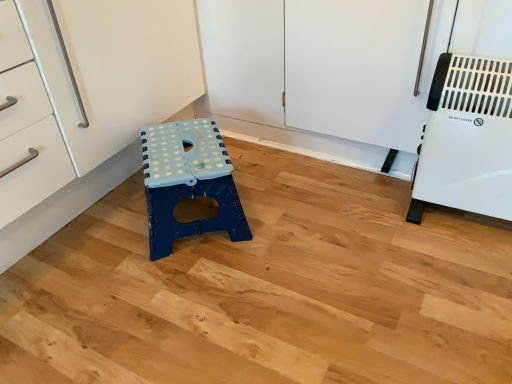
Identify the location of vacant area in front of white plastic heater at right. (464, 268).